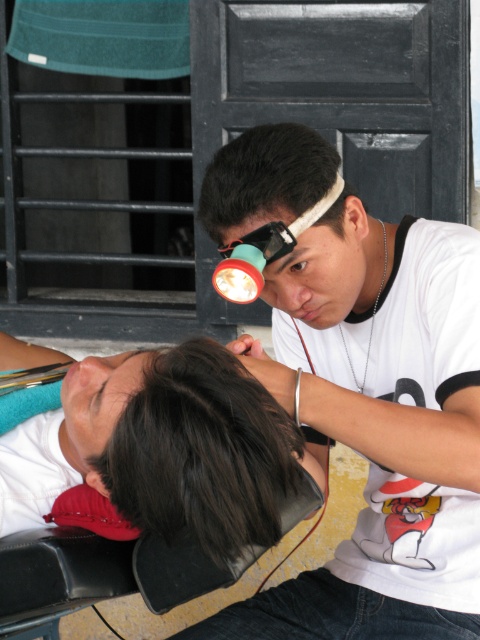
From the picture: You are a hair stylist trying to position your tools properly. You have a white matte headlamp at upper center and a brown matte eye at center. Which tool is positioned higher?

The white matte headlamp at upper center is positioned higher than the brown matte eye at center.

You are a customer at a hair salon and see the stylist wearing a white matte headlamp at upper center and a brown matte eye at center. Which object is taller?

The white matte headlamp at upper center is taller than the brown matte eye at center.

You are standing in front of the two people in the image. You want to place a small decorative item between the two points labeled as point (232, 541) and point (291, 262). Which point should the item be closer to so it appears larger to you?

The item should be placed closer to point (232, 541) because it is closer to the viewer than point (291, 262), making it appear larger when positioned near it.